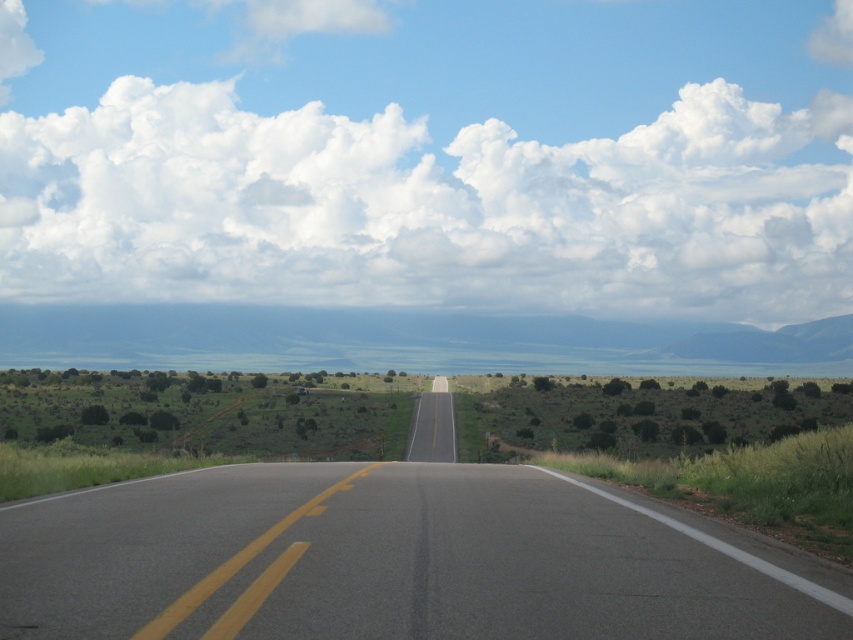
Who is higher up, green grassland at center or green grass at right?

green grassland at center is higher up.

Is green grassland at center below green grass at right?

No, green grassland at center is not below green grass at right.

Where is `green grassland at center`? The width and height of the screenshot is (853, 640). green grassland at center is located at coordinates tap(405, 340).

Who is taller, green grassland at center or asphalt road at center?

green grassland at center

Who is more forward, (154,326) or (442,416)?

Positioned in front is point (442,416).

Where is `green grassland at center`? The height and width of the screenshot is (640, 853). green grassland at center is located at coordinates (405, 340).

Is green grass at right thinner than asphalt road at center?

Incorrect, green grass at right's width is not less than asphalt road at center's.

Can you confirm if green grass at right is smaller than asphalt road at center?

Incorrect, green grass at right is not smaller in size than asphalt road at center.

Identify the location of green grass at right. (679, 461).